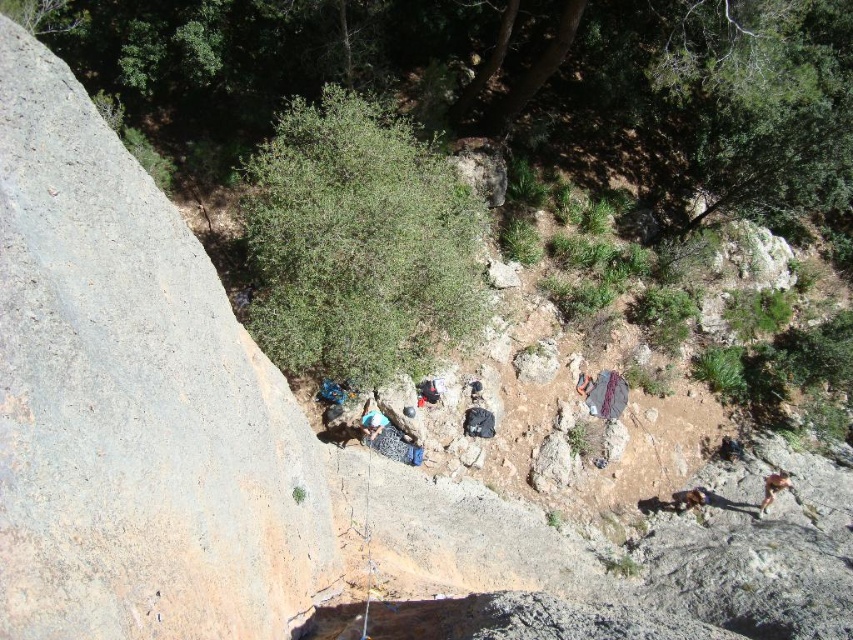
Question: From the image, what is the correct spatial relationship of gray rough rock at left in relation to camouflage fabric bag at center?

Choices:
 (A) below
 (B) above

Answer: (B)

Question: Can you confirm if gray rough rock at left is thinner than camouflage fabric bag at center?

Choices:
 (A) no
 (B) yes

Answer: (B)

Question: Among these points, which one is nearest to the camera?

Choices:
 (A) (38, 337)
 (B) (410, 448)

Answer: (A)

Question: Is gray rough rock at left bigger than camouflage fabric bag at center?

Choices:
 (A) yes
 (B) no

Answer: (B)